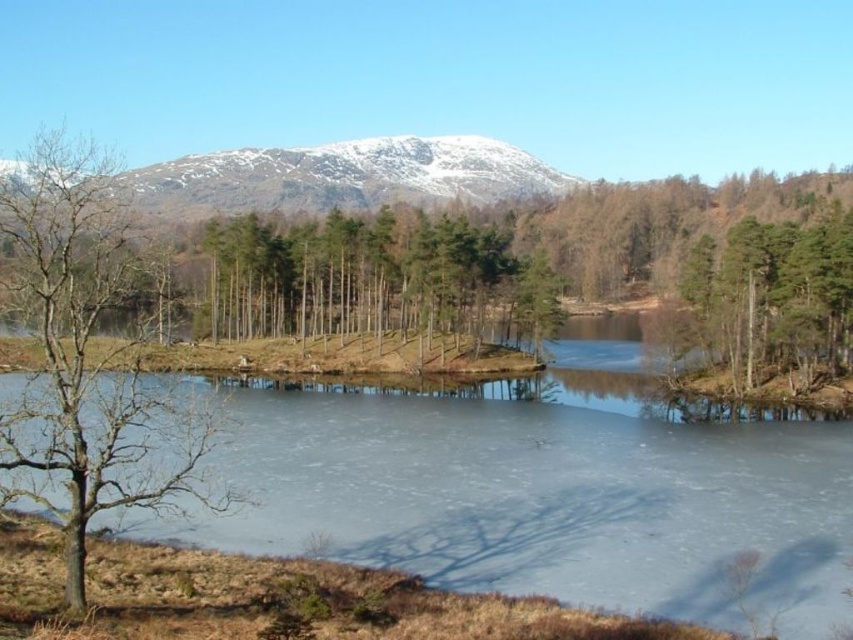
You are standing on the frozen lake and notice the frozen ice at center and the bare wood tree at left. Which object is closer to the ground?

The frozen ice at center is located below the bare wood tree at left, so it is closer to the ground.

You are standing at the edge of the frozen lake and want to walk towards the bare wood tree at left. Which direction should you move relative to the frozen ice at center?

Since the frozen ice at center is closer to the viewer than the bare wood tree at left, you should move towards the left away from the frozen ice at center to reach the bare wood tree at left.